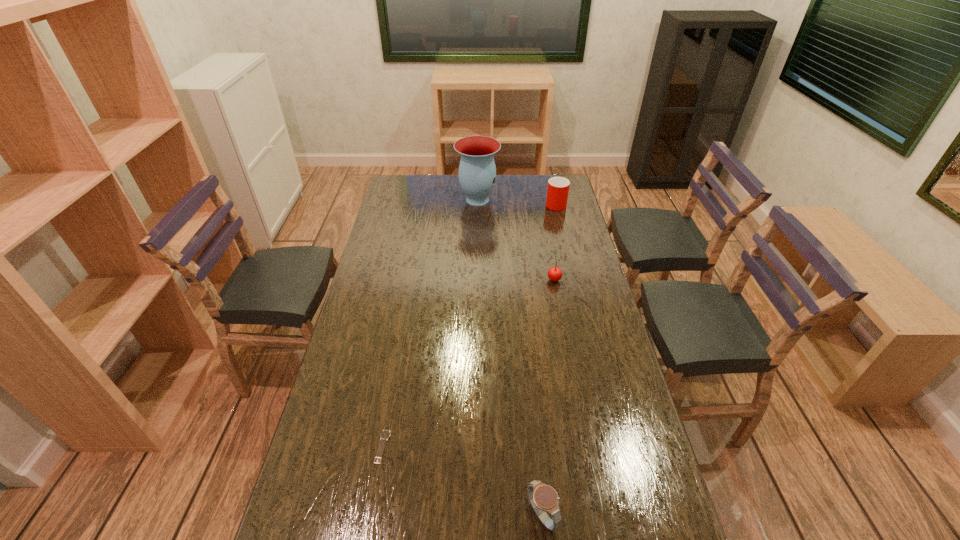
I want to click on the closest object relative to the tallest object, so click(558, 187).

Locate which object ranks second in proximity to the vase. Please provide its 2D coordinates. Your answer should be formatted as a tuple, i.e. [(x, y)], where the tuple contains the x and y coordinates of a point satisfying the conditions above.

[(554, 274)]